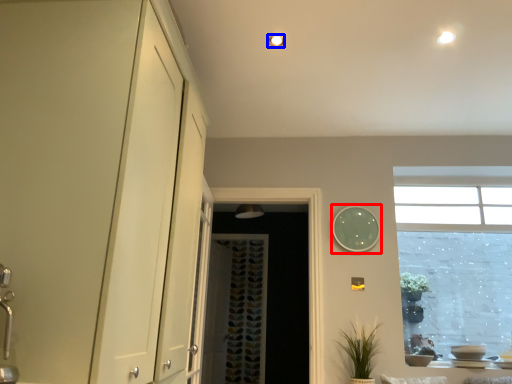
Question: Which of the following is the closest to the observer, clock (highlighted by a red box) or lighting (highlighted by a blue box)?

Choices:
 (A) clock
 (B) lighting

Answer: (B)